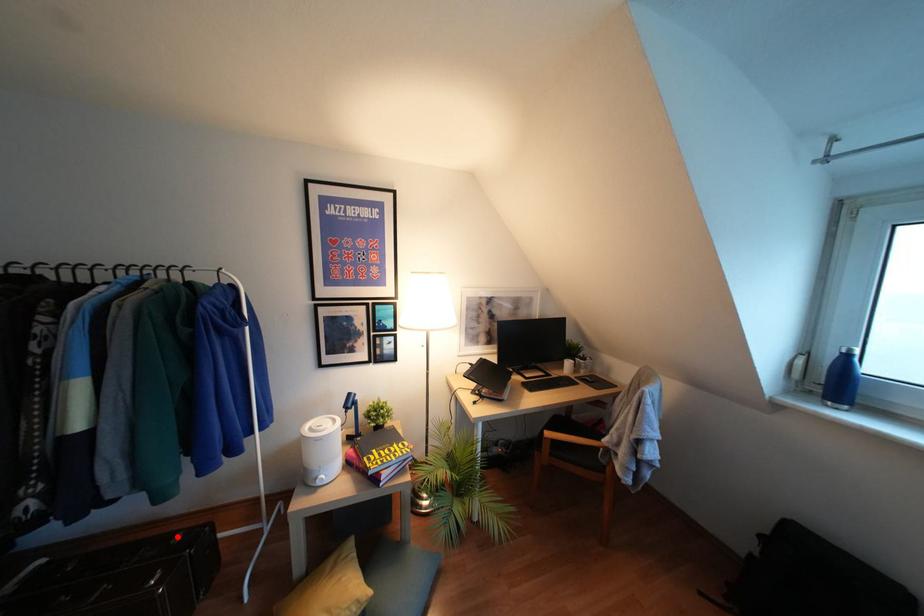
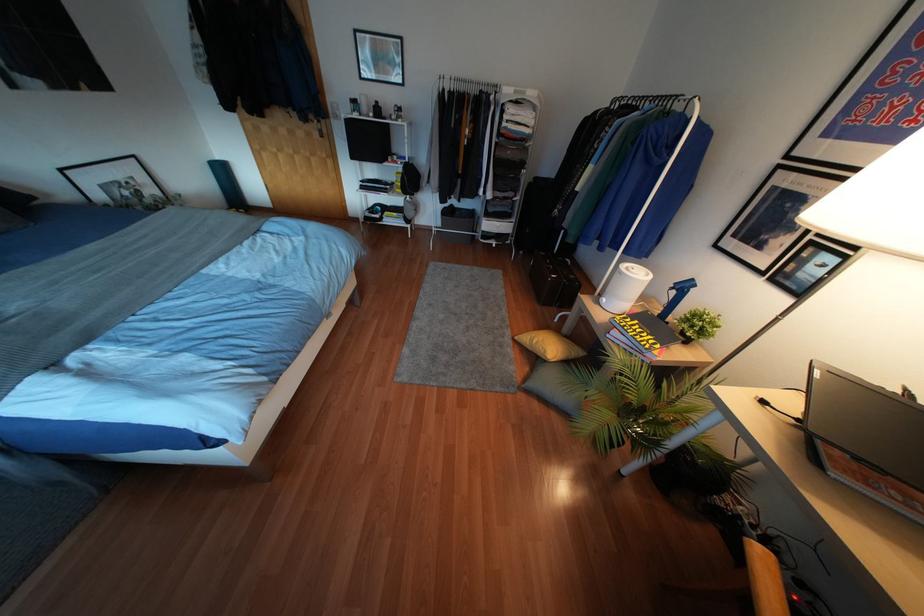
Find the pixel in the second image that matches the highlighted location in the first image.

(572, 277)